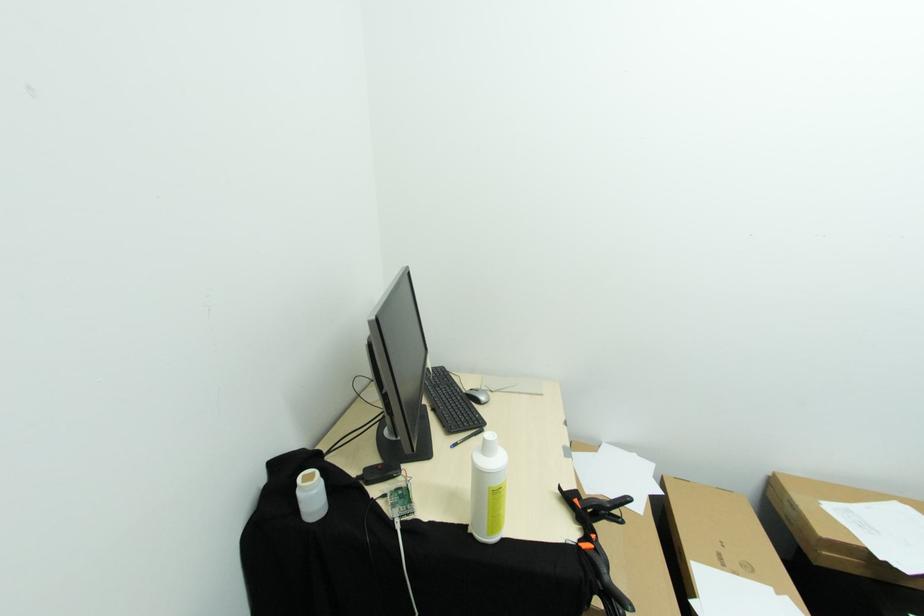
Find the location of a particular element. black clamp handle is located at coordinates (599, 546).